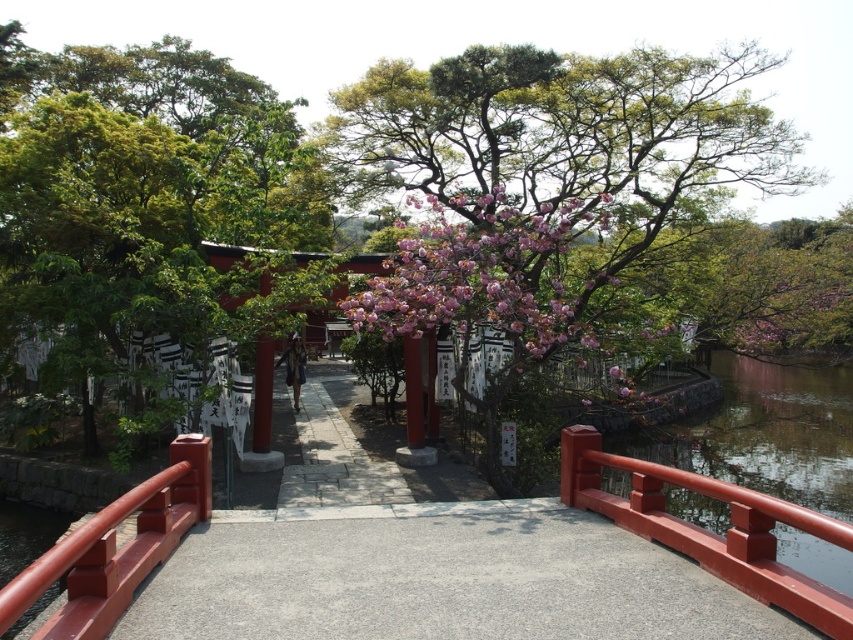
Between point (161, 253) and point (352, 465), which one is positioned in front?

Point (161, 253) is more forward.

Is pink blossoming tree at center to the right of paved stone path at center from the viewer's perspective?

No, pink blossoming tree at center is not to the right of paved stone path at center.

Between point (209, 131) and point (339, 417), which one is positioned in front?

Point (209, 131) is more forward.

Where is `pink blossoming tree at center`? pink blossoming tree at center is located at coordinates (141, 186).

Can you confirm if pink blossoming tree at center is positioned to the right of smooth glossy wood rail at right?

No, pink blossoming tree at center is not to the right of smooth glossy wood rail at right.

Is pink blossoming tree at center closer to the viewer compared to smooth glossy wood rail at right?

No, it is not.

Locate an element on the screen. pink blossoming tree at center is located at coordinates (141, 186).

Looking at this image, who is more distant from viewer, (50,636) or (312,396)?

The point (312,396) is more distant.

Does point (167, 513) lie in front of point (364, 493)?

Yes, point (167, 513) is closer to viewer.

Locate an element on the screen. The height and width of the screenshot is (640, 853). smooth red railing at lower left is located at coordinates (115, 548).